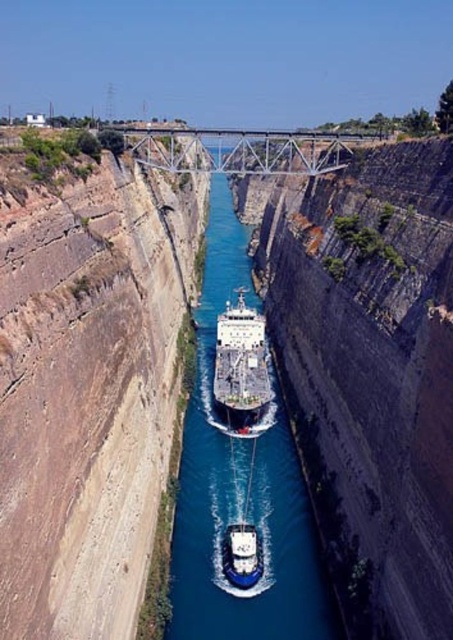
You are a photographer planning to capture the entire view of the Corinth Canal. You notice the blue smooth water at center and the white glossy ship at center in your frame. Which object will occupy more space in your photo?

The blue smooth water at center is bigger than the white glossy ship at center, so it will occupy more space in the photo.

You are standing at the edge of the Corinth Canal and see two points marked on the cliffs. The first point is at coordinates point [292,525] and the second is at point [250,564]. Which point is closer to you?

Point [292,525] is further to the viewer than point [250,564], so the second point is closer to you.

You are standing on the edge of the Corinth Canal and notice a point marked at coordinates (x=240, y=362). What object is located at that point?

The point at (x=240, y=362) indicates the white glossy ship at center.